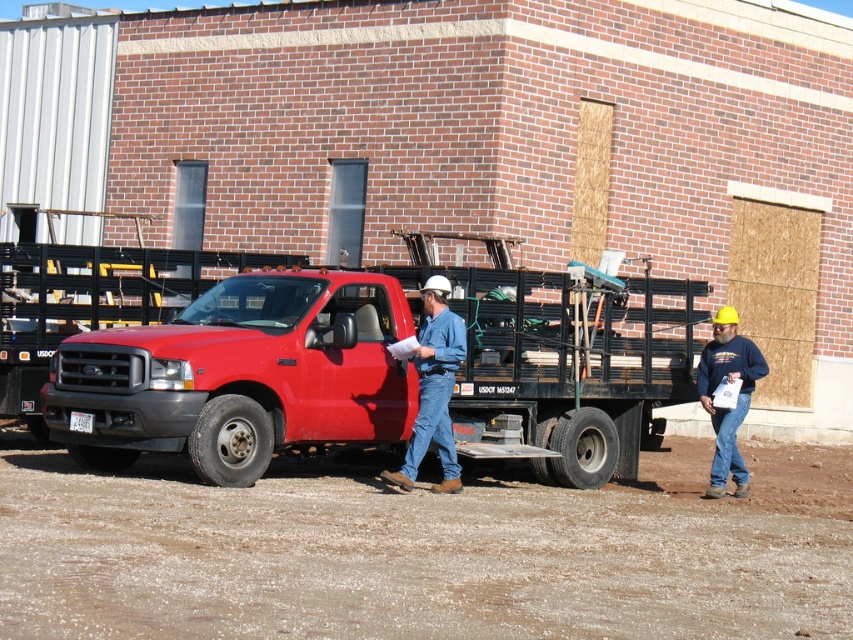
Is brown sandy dirt at lower center further to the viewer compared to blue sweatshirt at right?

No.

Is brown sandy dirt at lower center wider than blue sweatshirt at right?

Indeed, brown sandy dirt at lower center has a greater width compared to blue sweatshirt at right.

What do you see at coordinates (425, 552) in the screenshot?
I see `brown sandy dirt at lower center` at bounding box center [425, 552].

You are a GUI agent. You are given a task and a screenshot of the screen. Output one action in this format:
    pyautogui.click(x=<x>, y=<y>)
    Task: Click on the brown sandy dirt at lower center
    The image size is (853, 640).
    Given the screenshot: What is the action you would take?
    pyautogui.click(x=425, y=552)

Is matte red truck at center bigger than blue sweatshirt at right?

Yes, matte red truck at center is bigger than blue sweatshirt at right.

Does point (148, 371) come closer to viewer compared to point (759, 355)?

Yes, it is.

Locate an element on the screen. This screenshot has height=640, width=853. matte red truck at center is located at coordinates (376, 371).

Does brown sandy dirt at lower center appear under matte red truck at center?

Correct, brown sandy dirt at lower center is located below matte red truck at center.

From the picture: Between brown sandy dirt at lower center and matte red truck at center, which one has less height?

brown sandy dirt at lower center is shorter.

Describe the element at coordinates (425, 552) in the screenshot. I see `brown sandy dirt at lower center` at that location.

Identify the location of brown sandy dirt at lower center. (425, 552).